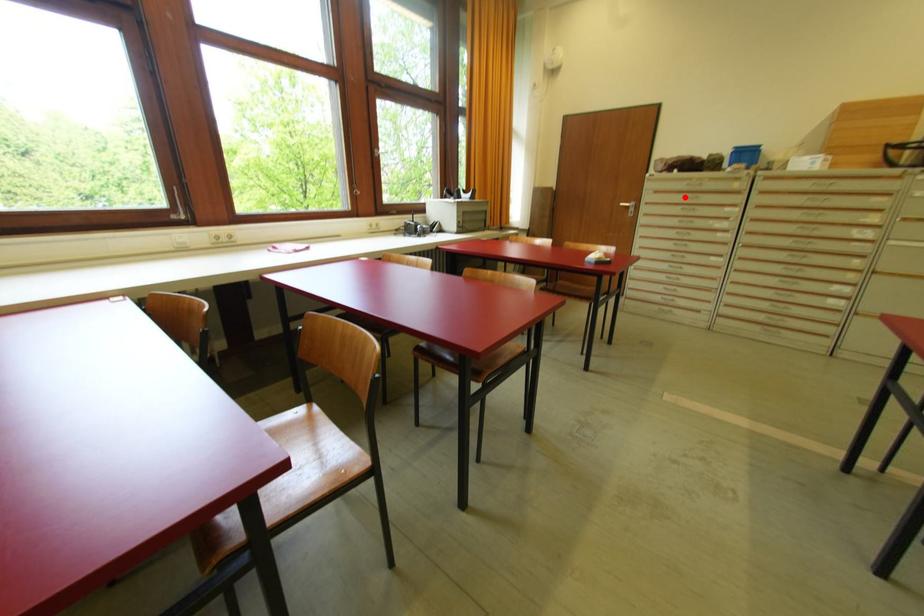
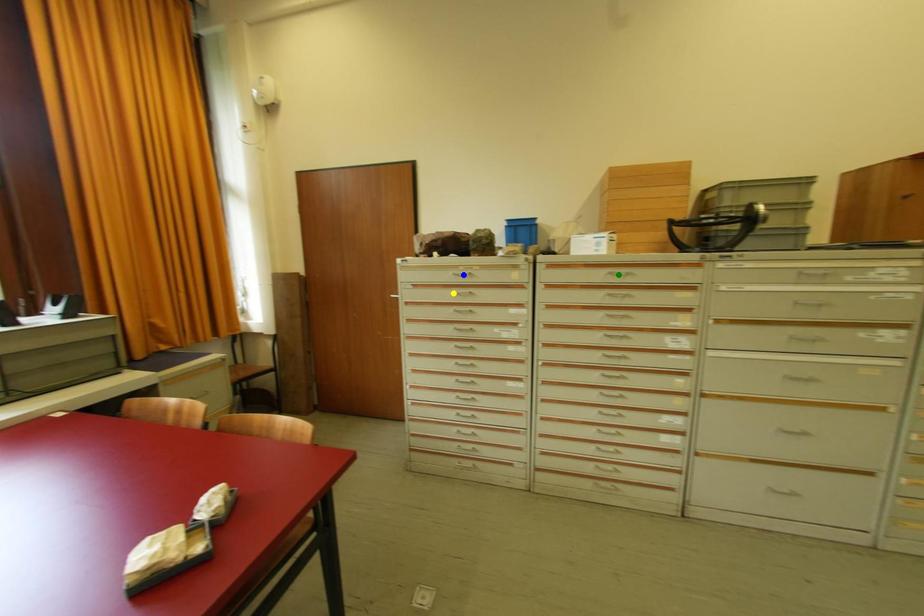
Question: I am providing you with two images of the same scene from different viewpoints. A red point is marked on the first image. You are given multiple points on the second image. In image 2, which mark is for the same physical point as the one in image 1?

Choices:
 (A) blue point
 (B) green point
 (C) yellow point

Answer: (C)